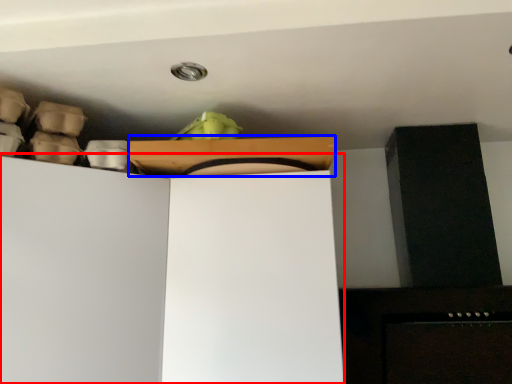
Question: Which point is closer to the camera, cabinetry (highlighted by a red box) or cardboard box (highlighted by a blue box)?

Choices:
 (A) cabinetry
 (B) cardboard box

Answer: (A)